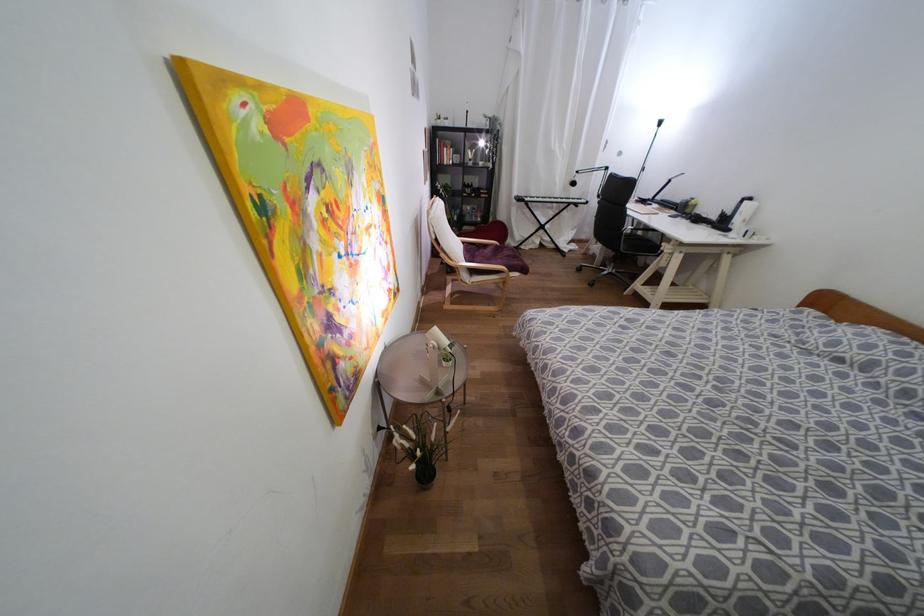
Which object does [421,443] point to?

It refers to a potted plant.